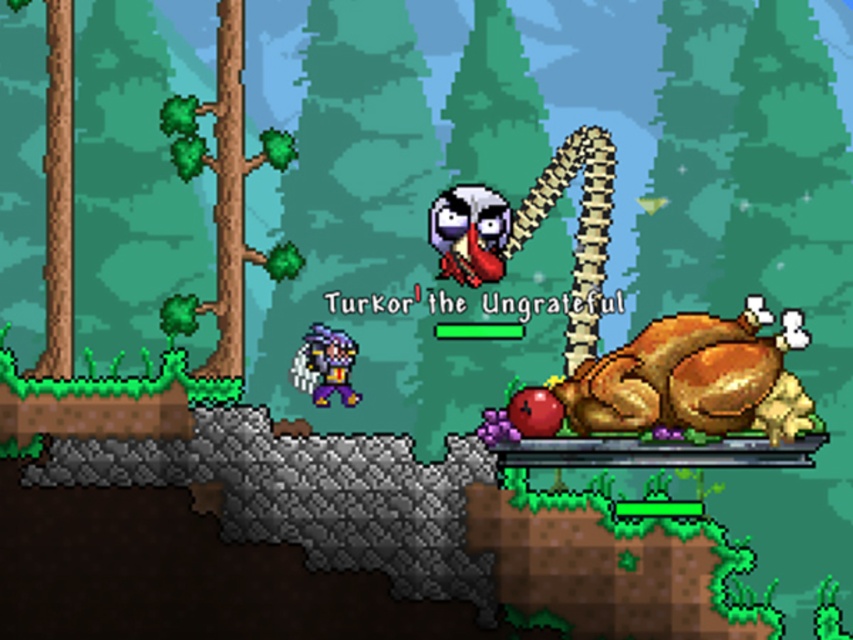
Question: Where is golden roasted turkey at right located in relation to green matte tree trunk at left in the image?

Choices:
 (A) below
 (B) above

Answer: (A)

Question: Which point is farther to the camera?

Choices:
 (A) golden roasted turkey at right
 (B) green matte tree trunk at left

Answer: (B)

Question: Which object appears closest to the camera in this image?

Choices:
 (A) golden roasted turkey at right
 (B) green matte tree trunk at left

Answer: (A)

Question: Can you confirm if golden roasted turkey at right is positioned above green matte tree trunk at left?

Choices:
 (A) no
 (B) yes

Answer: (A)

Question: Is golden roasted turkey at right below green matte tree trunk at left?

Choices:
 (A) yes
 (B) no

Answer: (A)